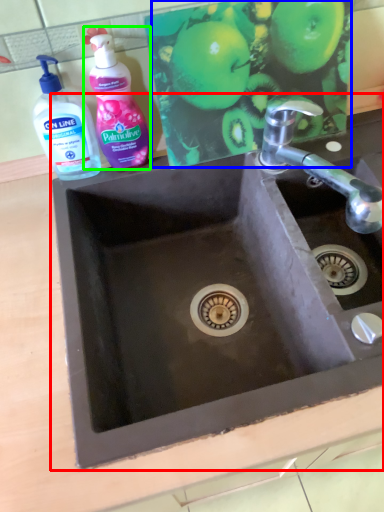
Question: Based on their relative distances, which object is nearer to sink (highlighted by a red box)? Choose from apple (highlighted by a blue box) and cleaning product (highlighted by a green box).

Choices:
 (A) apple
 (B) cleaning product

Answer: (A)